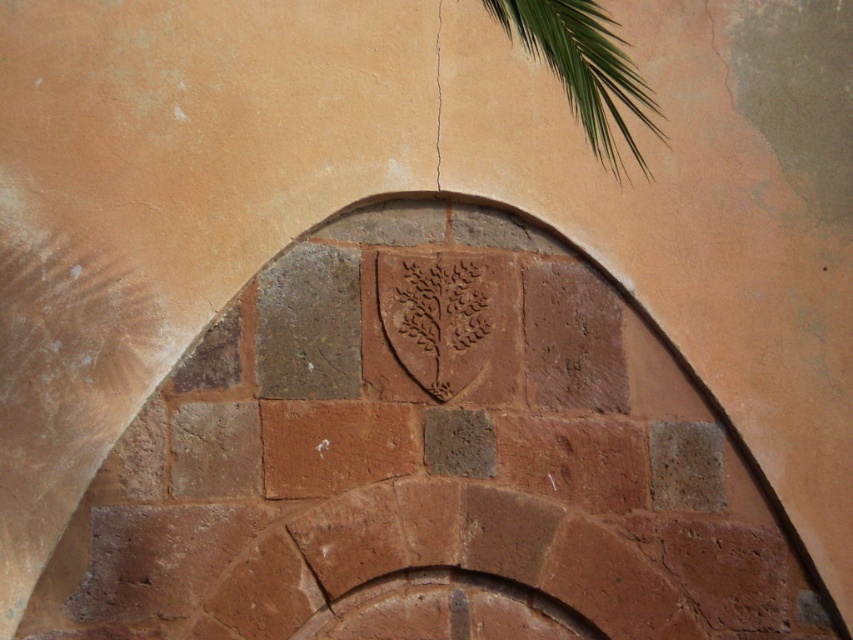
You are standing in front of an old building and notice the rustic stone archway at center and the green leafy palm at upper right. Which object is nearer to you?

The rustic stone archway at center is closer to the viewer than the green leafy palm at upper right.

You are standing in front of a historical building and see the rustic stone archway at center marked by point (x=430, y=461). If you want to take a photo of the archway, where should you position yourself relative to the point to ensure the entire archway is in the frame?

You should position yourself directly in front of the point (x=430, y=461) to ensure the entire rustic stone archway at center is centered and fully captured in the frame.

You are standing 10 meters away from an arched stone wall with an emblem. There is a green leafy palm at upper right. Can you tell if the palm is closer to you than the arch?

The green leafy palm at upper right is 9.92 meters from camera, so yes, the palm is closer to you than the arch since it is within the 10 meters distance.